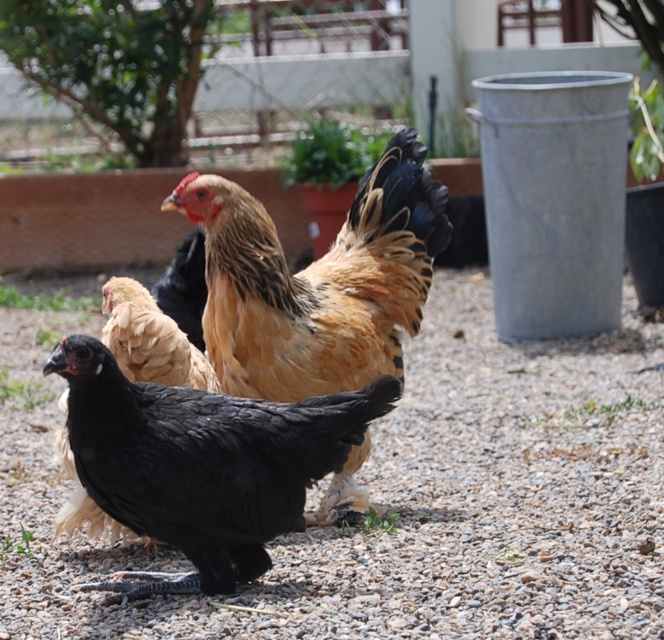
Who is higher up, gray gravel at center or black matte chicken at lower left?

Positioned higher is gray gravel at center.

Does gray gravel at center appear under black matte chicken at lower left?

Actually, gray gravel at center is above black matte chicken at lower left.

The image size is (664, 640). In order to click on gray gravel at center in this screenshot , I will do `click(396, 499)`.

Who is taller, gray gravel at center or golden-brown feathered chicken at center?

gray gravel at center is taller.

Is the position of gray gravel at center less distant than that of golden-brown feathered chicken at center?

Yes, gray gravel at center is closer to the viewer.

Identify the location of gray gravel at center. (396, 499).

This screenshot has width=664, height=640. What are the coordinates of `gray gravel at center` in the screenshot? It's located at (396, 499).

Can you confirm if black matte chicken at lower left is wider than golden-brown feathered chicken at center?

Correct, the width of black matte chicken at lower left exceeds that of golden-brown feathered chicken at center.

Is black matte chicken at lower left taller than golden-brown feathered chicken at center?

No.

Which is behind, point (376, 385) or point (373, 209)?

The point (373, 209) is behind.

Identify the location of black matte chicken at lower left. This screenshot has height=640, width=664. (201, 464).